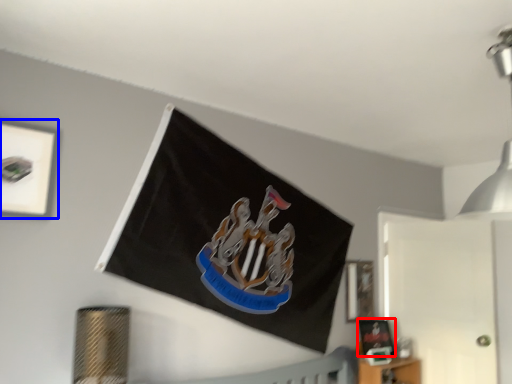
Question: Among these objects, which one is nearest to the camera, picture frame (highlighted by a red box) or picture frame (highlighted by a blue box)?

Choices:
 (A) picture frame
 (B) picture frame

Answer: (B)